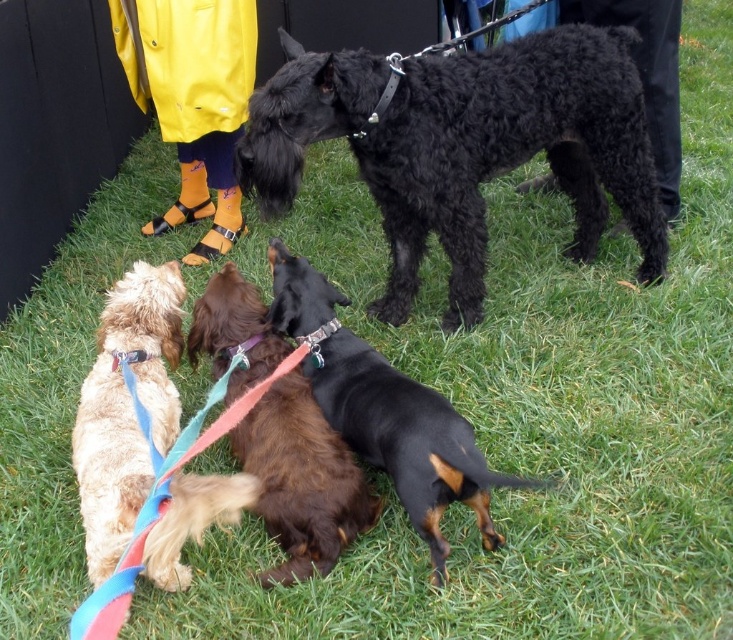
Question: Does brown shaggy dog at center have a larger size compared to brown fuzzy dog at center?

Choices:
 (A) yes
 (B) no

Answer: (A)

Question: Which object is closer to the camera taking this photo?

Choices:
 (A) black curly fur dog at upper center
 (B) shiny golden fur at lower left
 (C) brown fuzzy dog at center

Answer: (B)

Question: Which point is closer to the camera?

Choices:
 (A) (161, 561)
 (B) (239, 428)

Answer: (A)

Question: Among these objects, which one is nearest to the camera?

Choices:
 (A) black curly fur dog at upper center
 (B) shiny golden fur at lower left
 (C) brown fuzzy dog at center

Answer: (B)

Question: Can you confirm if black curly fur dog at upper center is smaller than shiny golden fur at lower left?

Choices:
 (A) yes
 (B) no

Answer: (B)

Question: Can you confirm if black curly fur dog at upper center is positioned below shiny golden fur at lower left?

Choices:
 (A) yes
 (B) no

Answer: (B)